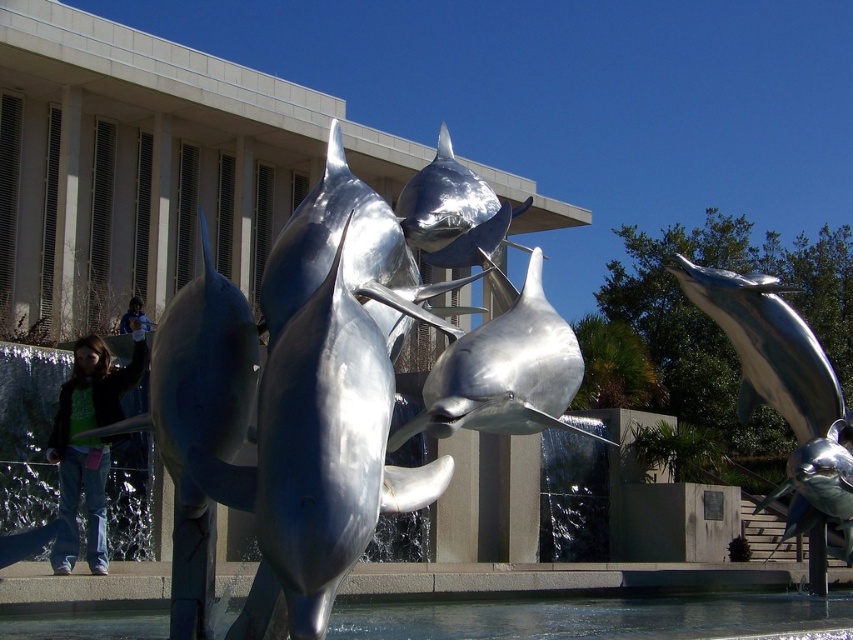
You are a visitor standing in front of the sculpture and want to take a photo of the shiny silver dolphin at right without any water in the background. Based on the scene description, where should you position yourself relative to the clear water at lower center?

You should position yourself to the right of the clear water at lower center so that the shiny silver dolphin at right is framed away from the water, ensuring the background remains clear of water.

You are an architect designing a new plaza and want to place a bench where visitors can view both the clear water at lower center and the shiny silver dolphin at right without obstruction. Based on the scene, is there enough space between them for the bench?

The clear water at lower center occupies less space than the shiny silver dolphin at right, so there is sufficient space between them to place a bench where visitors can view both without obstruction.

You are an art installer who needs to place a 1.5 meter wide decorative panel between the shiny silver dolphin at left and the shiny silver dolphin at center. Based on the sculpture layout, will the panel fit between them?

The distance between the shiny silver dolphin at left and the shiny silver dolphin at center is 1.70 meters. Since the panel is 1.5 meters wide, it will fit as there is enough space between them.